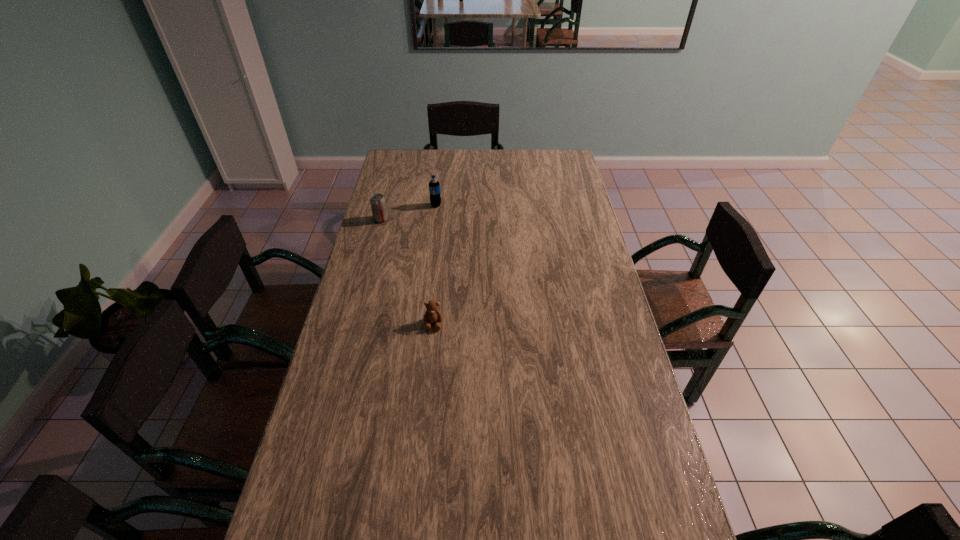
At what (x,y) coordinates should I click in order to perform the action: click on the second closest object to the shorter soda can. Please return your answer as a coordinate pair (x, y). Image resolution: width=960 pixels, height=540 pixels. Looking at the image, I should click on (432, 315).

What are the coordinates of `free space that satisfies the following two spatial constraints: 1. on the back side of the tallest object; 2. on the left side of the shorter soda can` in the screenshot? It's located at (385, 205).